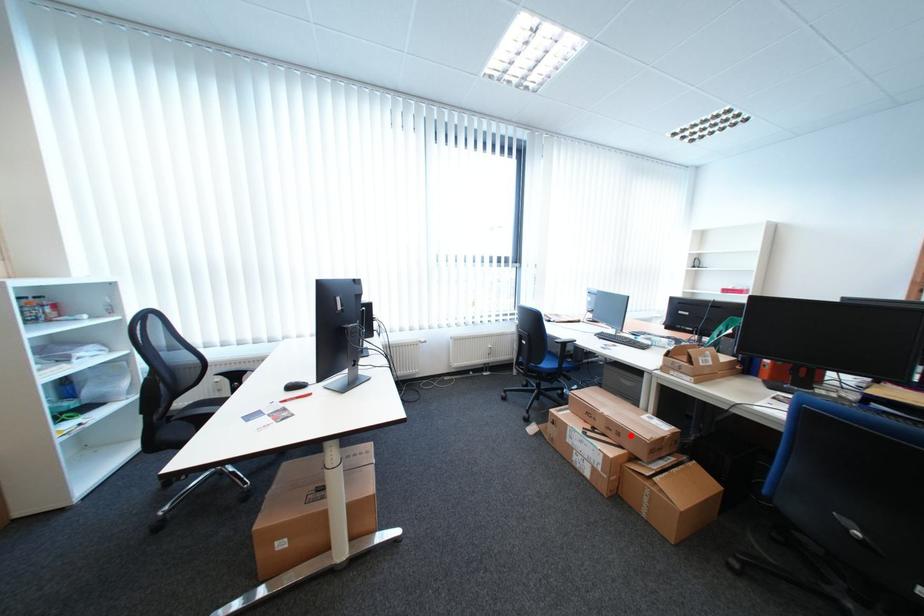
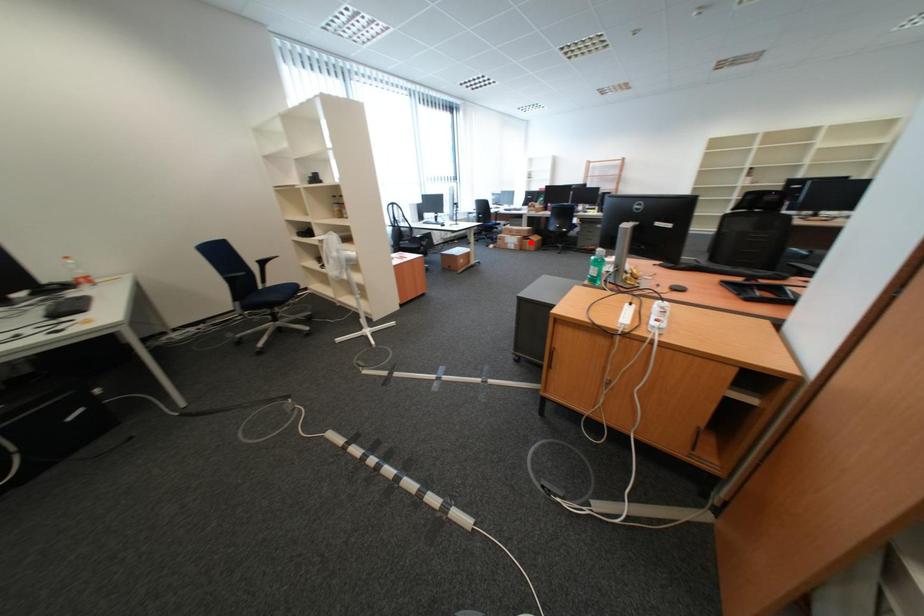
I am providing you with two images of the same scene from different viewpoints. A red point is marked on the first image and another point is marked on the second image. Is the marked point in image1 the same physical position as the marked point in image2?

No